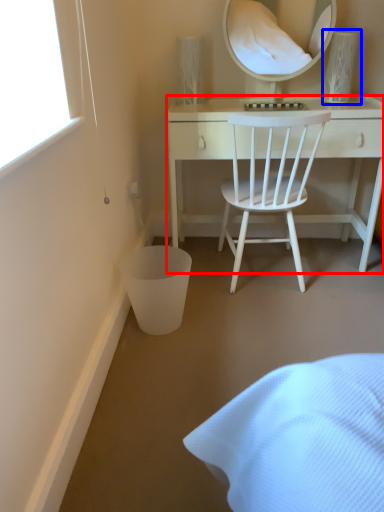
Question: Which point is further to the camera, desk (highlighted by a red box) or table lamp (highlighted by a blue box)?

Choices:
 (A) desk
 (B) table lamp

Answer: (B)